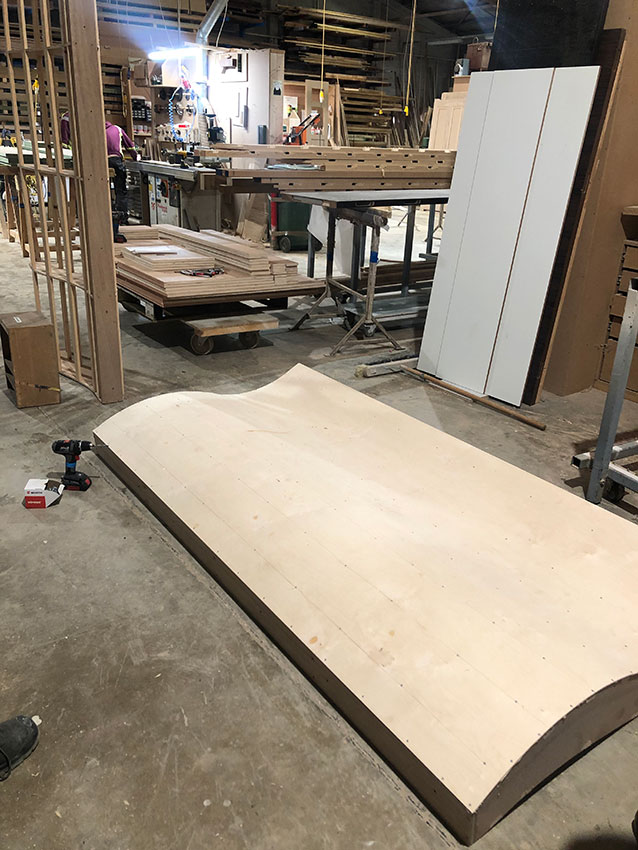
At what (x,y) coordinates should I click in order to perform the action: click on wood planks. Please return your answer as a coordinate pair (x, y). The image size is (638, 850). Looking at the image, I should click on (180, 289).